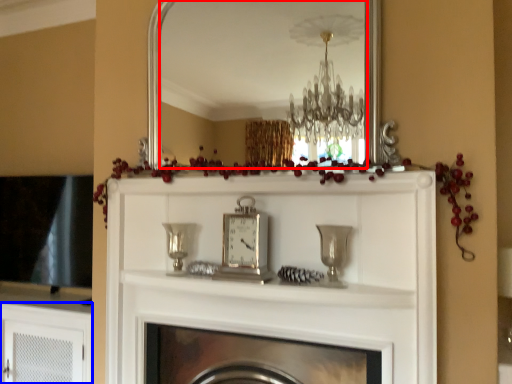
Question: Which of the following is the closest to the observer, mirror (highlighted by a red box) or cabinetry (highlighted by a blue box)?

Choices:
 (A) mirror
 (B) cabinetry

Answer: (A)